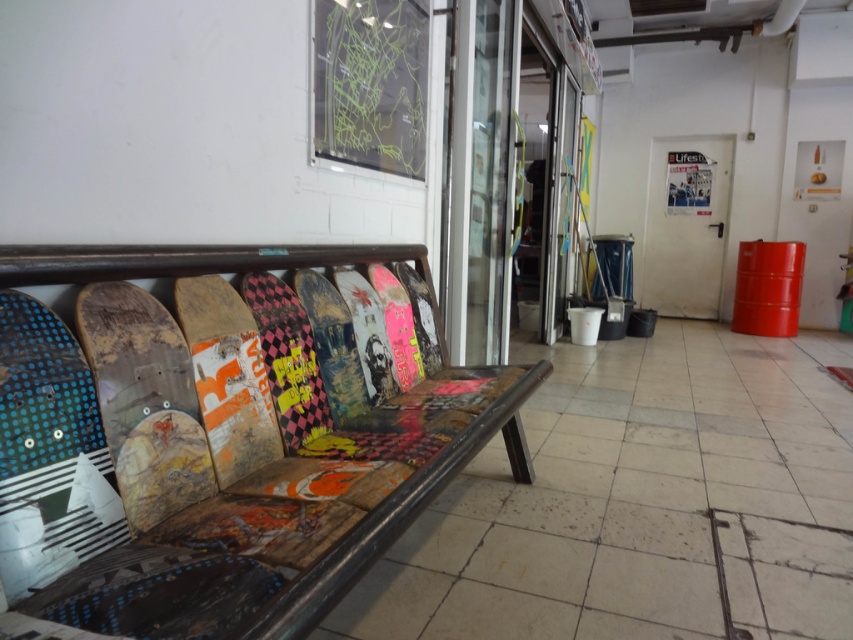
Question: Where is wooden skateboard bench at left located in relation to shiny pink wood skateboard at center in the image?

Choices:
 (A) above
 (B) below

Answer: (B)

Question: Which point is farther from the camera taking this photo?

Choices:
 (A) [18, 452]
 (B) [367, 387]

Answer: (B)

Question: Which point is farther from the camera taking this photo?

Choices:
 (A) (265, 508)
 (B) (144, 324)
 (C) (285, 435)
 (D) (405, 355)

Answer: (D)

Question: Is wooden skateboard at left thinner than multi-colored painted skateboard at center?

Choices:
 (A) yes
 (B) no

Answer: (A)

Question: Does blue polka dot wood skateboard at left have a greater width compared to checkered matte skateboard at center?

Choices:
 (A) no
 (B) yes

Answer: (A)

Question: Which of the following is the farthest from the observer?

Choices:
 (A) wooden skateboard bench at left
 (B) multi-colored painted skateboard at center

Answer: (B)